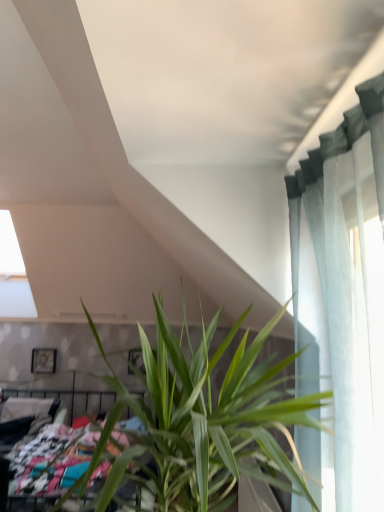
Where is `green leafy plant at center`? This screenshot has width=384, height=512. green leafy plant at center is located at coordinates (205, 420).

Where is `multicolored fabric bed at lower left`? multicolored fabric bed at lower left is located at coordinates (50, 461).

From a real-world perspective, which object stands above the other?

In real-world perspective, green leafy plant at center is above.

From the picture: Is green leafy plant at center directly adjacent to wooden picture frame at upper left?

They are not placed beside each other.

Between green leafy plant at center and wooden picture frame at upper left, which one appears on the right side from the viewer's perspective?

From the viewer's perspective, green leafy plant at center appears more on the right side.

Considering the positions of point (224, 503) and point (48, 361), is point (224, 503) closer or farther from the camera than point (48, 361)?

Point (224, 503) is positioned closer to the camera compared to point (48, 361).

Identify the location of picture frame on the left of multicolored fabric bed at lower left. pyautogui.click(x=43, y=360).

From the image's perspective, is multicolored fabric bed at lower left above or below wooden picture frame at upper left?

multicolored fabric bed at lower left is below wooden picture frame at upper left.

Is multicolored fabric bed at lower left bigger than wooden picture frame at upper left?

Yes.

Based on the photo, between multicolored fabric bed at lower left and wooden picture frame at upper left, which one appears on the right side from the viewer's perspective?

Positioned to the right is multicolored fabric bed at lower left.

Would you say wooden picture frame at upper left is outside multicolored fabric bed at lower left?

wooden picture frame at upper left is positioned outside multicolored fabric bed at lower left.

Is wooden picture frame at upper left aimed at multicolored fabric bed at lower left?

No, wooden picture frame at upper left is not turned towards multicolored fabric bed at lower left.

Is wooden picture frame at upper left thinner than multicolored fabric bed at lower left?

Correct, the width of wooden picture frame at upper left is less than that of multicolored fabric bed at lower left.

Does point (30, 446) appear closer or farther from the camera than point (283, 471)?

Clearly, point (30, 446) is more distant from the camera than point (283, 471).

From a real-world perspective, which object rests below the other?

In real-world perspective, multicolored fabric bed at lower left is lower.

Between multicolored fabric bed at lower left and green leafy plant at center, which one appears on the left side from the viewer's perspective?

multicolored fabric bed at lower left.

Can you confirm if multicolored fabric bed at lower left is wider than green leafy plant at center?

Correct, the width of multicolored fabric bed at lower left exceeds that of green leafy plant at center.

The image size is (384, 512). In order to click on houseplant positioned vertically above the multicolored fabric bed at lower left (from a real-world perspective) in this screenshot , I will do `click(205, 420)`.

Looking at this image, considering the sizes of green leafy plant at center and multicolored fabric bed at lower left in the image, is green leafy plant at center wider or thinner than multicolored fabric bed at lower left?

In the image, green leafy plant at center appears to be more narrow than multicolored fabric bed at lower left.

Can you confirm if green leafy plant at center is bigger than multicolored fabric bed at lower left?

Actually, green leafy plant at center might be smaller than multicolored fabric bed at lower left.

Consider the image. How much distance is there between green leafy plant at center and multicolored fabric bed at lower left?

A distance of 5.03 feet exists between green leafy plant at center and multicolored fabric bed at lower left.

Which of these two, wooden picture frame at upper left or green leafy plant at center, is bigger?

green leafy plant at center.

In the image, there is a green leafy plant at center. Identify the location of picture frame below it (from the image's perspective). The width and height of the screenshot is (384, 512). (43, 360).

Does wooden picture frame at upper left turn towards green leafy plant at center?

Yes, wooden picture frame at upper left faces towards green leafy plant at center.

From the image's perspective, is wooden picture frame at upper left located above or below green leafy plant at center?

From the image's perspective, wooden picture frame at upper left appears below green leafy plant at center.

At what (x,y) coordinates should I click in order to perform the action: click on houseplant above the wooden picture frame at upper left (from the image's perspective). Please return your answer as a coordinate pair (x, y). This screenshot has height=512, width=384. Looking at the image, I should click on (205, 420).

You are a GUI agent. You are given a task and a screenshot of the screen. Output one action in this format:
    pyautogui.click(x=<x>, y=<y>)
    Task: Click on the bed on the right of the wooden picture frame at upper left
    Image resolution: width=384 pixels, height=512 pixels.
    Given the screenshot: What is the action you would take?
    pyautogui.click(x=50, y=461)

Looking at the image, which one is located closer to wooden picture frame at upper left, green leafy plant at center or multicolored fabric bed at lower left?

The object closer to wooden picture frame at upper left is multicolored fabric bed at lower left.

Based on their spatial positions, is multicolored fabric bed at lower left or green leafy plant at center further from wooden picture frame at upper left?

Based on the image, green leafy plant at center appears to be further to wooden picture frame at upper left.

Considering their positions, is wooden picture frame at upper left positioned closer to green leafy plant at center than multicolored fabric bed at lower left?

multicolored fabric bed at lower left.

In the scene shown: From the image, which object appears to be nearer to multicolored fabric bed at lower left, wooden picture frame at upper left or green leafy plant at center?

Based on the image, green leafy plant at center appears to be nearer to multicolored fabric bed at lower left.

From the image, which object appears to be nearer to multicolored fabric bed at lower left, green leafy plant at center or wooden picture frame at upper left?

green leafy plant at center lies closer to multicolored fabric bed at lower left than the other object.

From the image, which object appears to be nearer to green leafy plant at center, multicolored fabric bed at lower left or wooden picture frame at upper left?

Based on the image, multicolored fabric bed at lower left appears to be nearer to green leafy plant at center.

I want to click on bed between green leafy plant at center and wooden picture frame at upper left from front to back, so click(x=50, y=461).